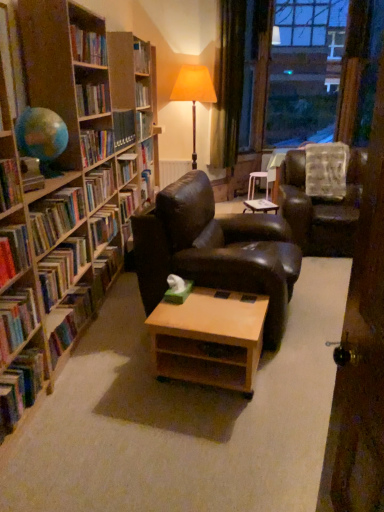
Question: From a real-world perspective, is hardcover book at left, which is counted as the sixth book, starting from the top, physically below hardcover books at left, marked as the 5th book in a top-to-bottom arrangement?

Choices:
 (A) no
 (B) yes

Answer: (A)

Question: Can you confirm if hardcover book at left, arranged as the third book when ordered from the bottom, is bigger than hardcover books at left, marked as the 4th book in a bottom-to-top arrangement?

Choices:
 (A) no
 (B) yes

Answer: (A)

Question: From the image's perspective, does hardcover book at left, which is counted as the sixth book, starting from the top, appear higher than hardcover books at left, marked as the 4th book in a bottom-to-top arrangement?

Choices:
 (A) yes
 (B) no

Answer: (B)

Question: Is hardcover book at left, which is counted as the sixth book, starting from the top, oriented away from hardcover books at left, marked as the 5th book in a top-to-bottom arrangement?

Choices:
 (A) no
 (B) yes

Answer: (A)

Question: Is hardcover books at left, marked as the 5th book in a top-to-bottom arrangement, a part of hardcover book at left, which is counted as the sixth book, starting from the top?

Choices:
 (A) yes
 (B) no

Answer: (B)

Question: From the image's perspective, is hardcover books at left, the sixth book when ordered from bottom to top, located above or below hardcover book at left, the second book viewed from the top?

Choices:
 (A) above
 (B) below

Answer: (B)

Question: In terms of height, does hardcover books at left, which appears as the third book when viewed from the top, look taller or shorter compared to hardcover book at left, which is counted as the 7th book, starting from the bottom?

Choices:
 (A) short
 (B) tall

Answer: (A)

Question: Would you say hardcover books at left, the sixth book when ordered from bottom to top, is to the left or to the right of hardcover book at left, the second book viewed from the top, in the picture?

Choices:
 (A) left
 (B) right

Answer: (A)

Question: Is hardcover books at left, which appears as the third book when viewed from the top, inside the boundaries of hardcover book at left, the second book viewed from the top, or outside?

Choices:
 (A) outside
 (B) inside

Answer: (A)

Question: Is point (13, 370) positioned closer to the camera than point (79, 211)?

Choices:
 (A) farther
 (B) closer

Answer: (B)

Question: From a real-world perspective, relative to hardcover books at left, which appears as the third book when viewed from the top, is hardcover book at lower left, the first book ordered from the bottom, vertically above or below?

Choices:
 (A) below
 (B) above

Answer: (A)

Question: Would you say hardcover book at lower left, which is the eighth book in top-to-bottom order, is to the left or to the right of hardcover books at left, which appears as the third book when viewed from the top, in the picture?

Choices:
 (A) left
 (B) right

Answer: (A)

Question: Choose the correct answer: Is hardcover book at lower left, the first book ordered from the bottom, inside hardcover books at left, the sixth book when ordered from bottom to top, or outside it?

Choices:
 (A) inside
 (B) outside

Answer: (B)

Question: Considering their positions, is transparent glass window at upper right located in front of or behind hardcover books at left, marked as the 4th book in a bottom-to-top arrangement?

Choices:
 (A) behind
 (B) front

Answer: (A)

Question: Is transparent glass window at upper right inside the boundaries of hardcover books at left, marked as the 5th book in a top-to-bottom arrangement, or outside?

Choices:
 (A) outside
 (B) inside

Answer: (A)